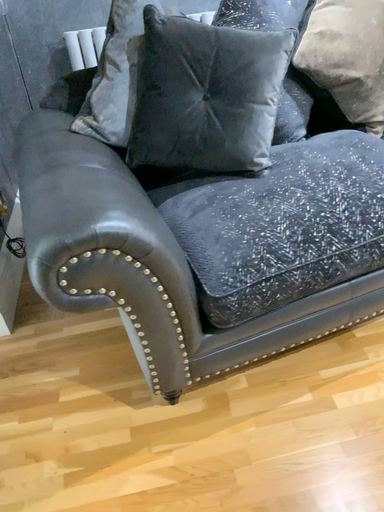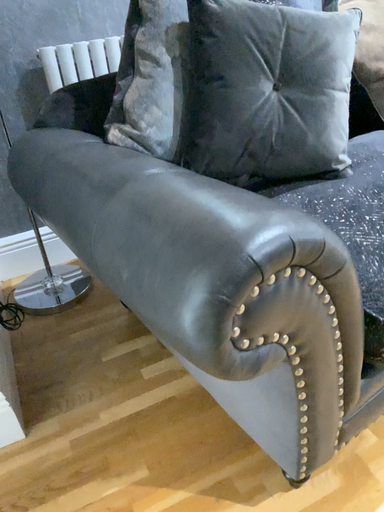
Question: Which way did the camera rotate in the video?

Choices:
 (A) rotated left
 (B) rotated right

Answer: (B)